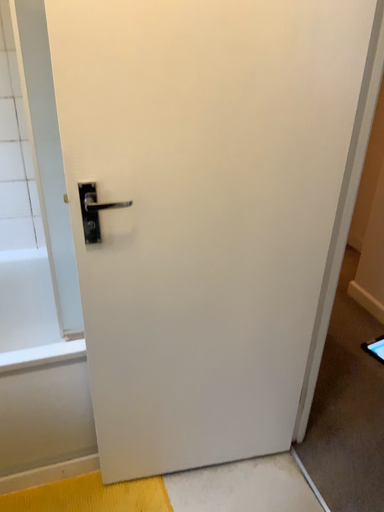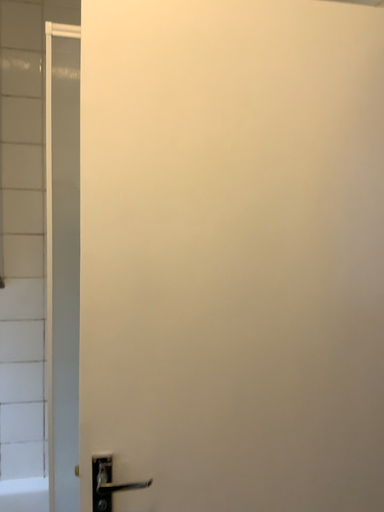
Question: How did the camera likely rotate when shooting the video?

Choices:
 (A) rotated downward
 (B) rotated upward

Answer: (B)